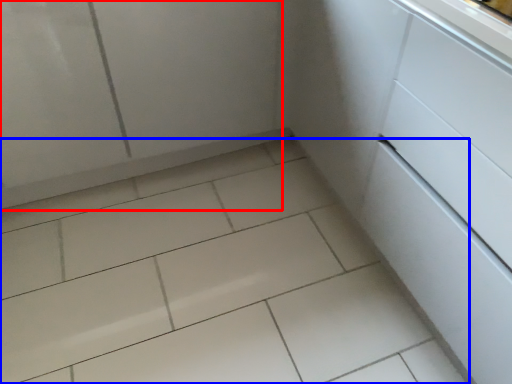
Question: Among these objects, which one is farthest to the camera, screen door (highlighted by a red box) or ceramic tile (highlighted by a blue box)?

Choices:
 (A) screen door
 (B) ceramic tile

Answer: (A)